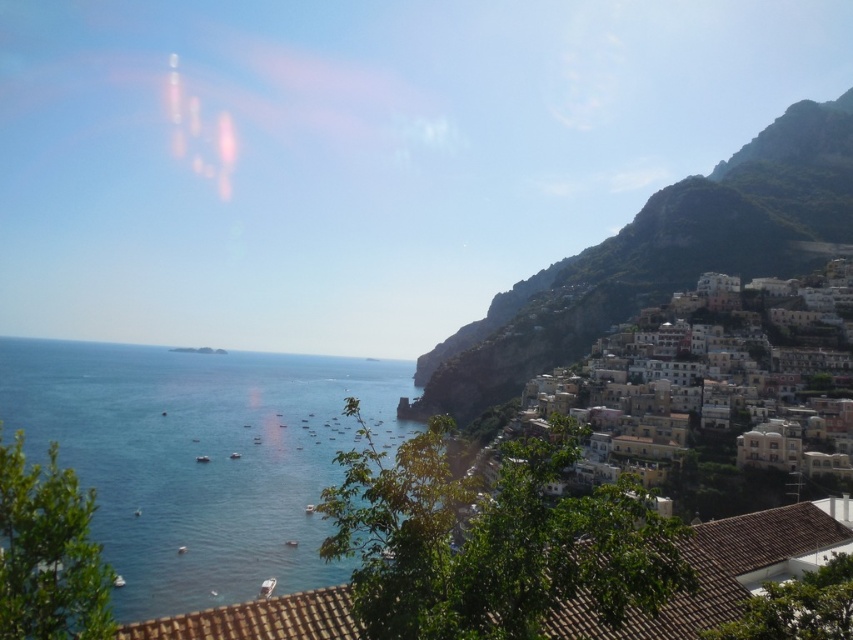
Question: Is blue water at center to the left of rugged rock mountain at right from the viewer's perspective?

Choices:
 (A) yes
 (B) no

Answer: (A)

Question: Which point is farther from the camera taking this photo?

Choices:
 (A) (838, 200)
 (B) (178, 390)

Answer: (B)

Question: Is blue water at center to the right of rugged rock mountain at right from the viewer's perspective?

Choices:
 (A) yes
 (B) no

Answer: (B)

Question: Can you confirm if blue water at center is positioned below rugged rock mountain at right?

Choices:
 (A) yes
 (B) no

Answer: (A)

Question: Which object is closer to the camera taking this photo?

Choices:
 (A) white stucco buildings at right
 (B) blue water at center
 (C) rugged rock mountain at right

Answer: (B)

Question: Which object is the farthest from the white stucco buildings at right?

Choices:
 (A) blue water at center
 (B) rugged rock mountain at right

Answer: (A)